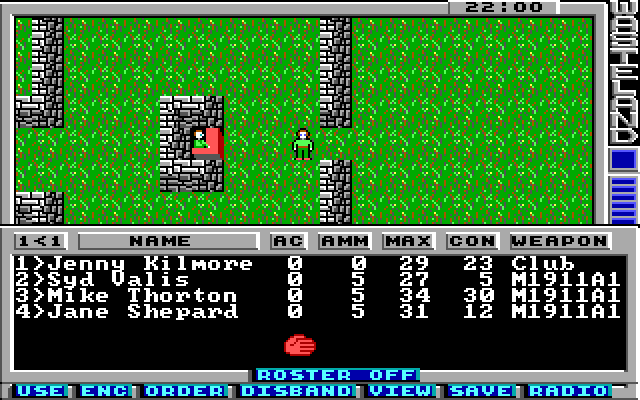
Find the location of a particular element. This screenshot has height=400, width=640. timer is located at coordinates (486, 7).